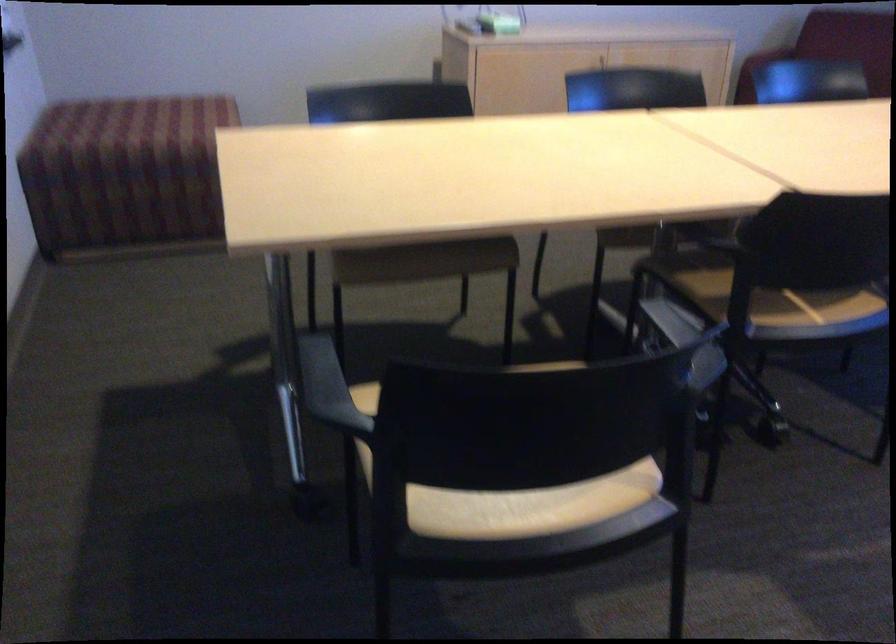
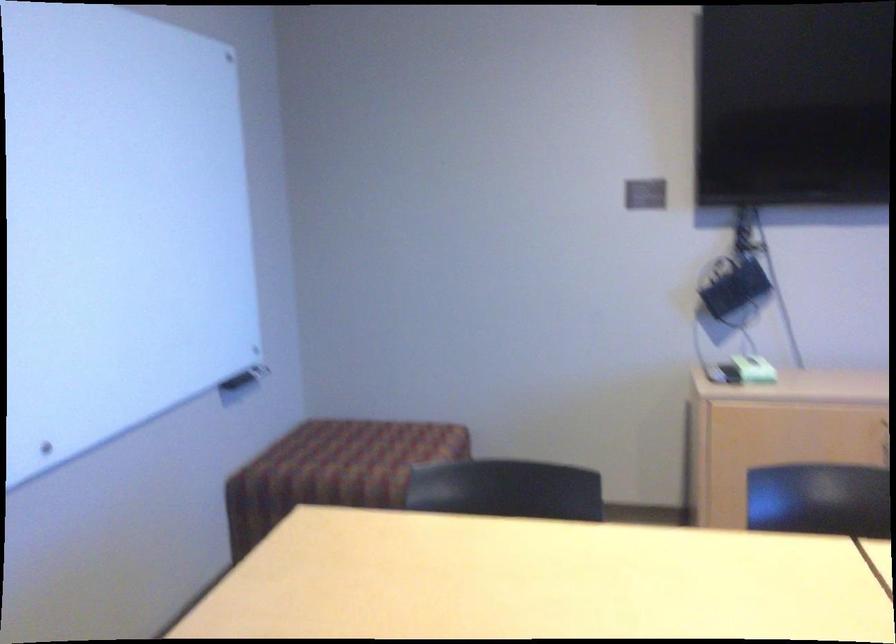
Locate, in the second image, the point that corresponds to point (109, 140) in the first image.

(331, 465)